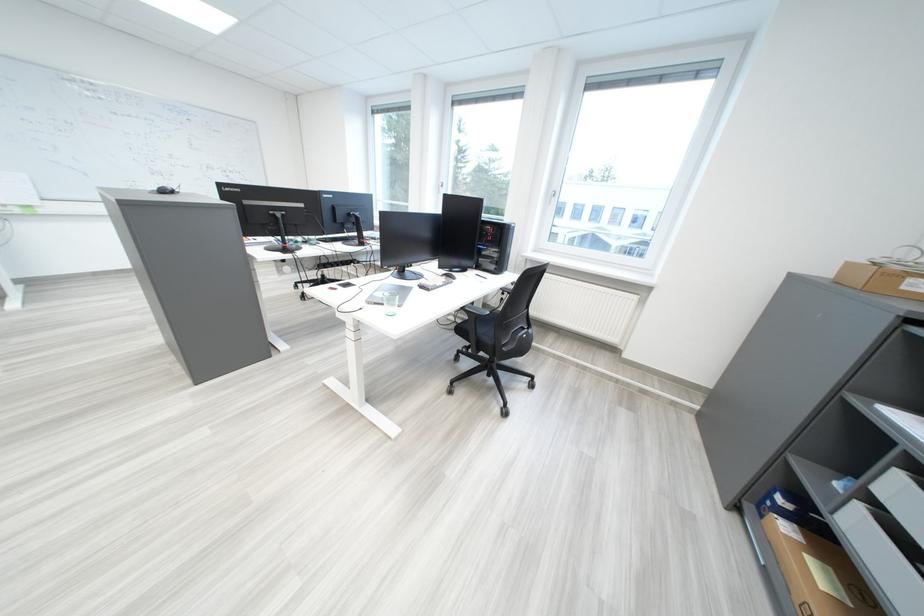
At what (x,y) coordinates should I click in order to perform the action: click on cardboard box. Please return your answer as a coordinate pair (x, y). Looking at the image, I should click on (881, 280).